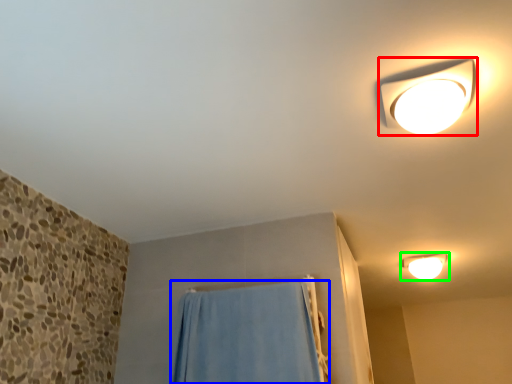
Question: Which object is the farthest from lamp (highlighted by a red box)? Choose among these: curtain (highlighted by a blue box) or lamp (highlighted by a green box).

Choices:
 (A) curtain
 (B) lamp

Answer: (B)